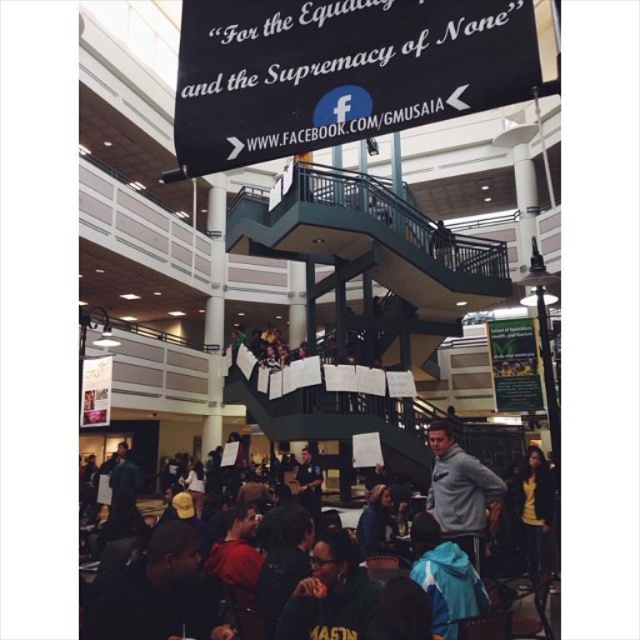
Consider the image. You are an event organizer who needs to ensure visibility for both the black fabric sign at upper center and the green jersey at lower center. Given their sizes, which object should be placed in a position where it can be seen from a greater distance?

The black fabric sign at upper center should be placed in a position where it can be seen from a greater distance because it is bigger than the green jersey at lower center.

You are a visitor at this event and want to take a photo of the dark gray hoodie at center without the black fabric sign at upper center appearing in the frame. Is this possible given their sizes?

The black fabric sign at upper center has a lesser width compared to dark gray hoodie at center. Since the sign is narrower, you can position yourself or adjust your camera angle to exclude it while capturing the hoodie.

Based on the photo, you are standing in the middle of the staircase in the image. You see a green jersey at lower center and a gray fleece sweatshirt at lower right. Which clothing item is positioned lower in the scene?

The green jersey at lower center is located below the gray fleece sweatshirt at lower right, so the green jersey at lower center is positioned lower in the scene.